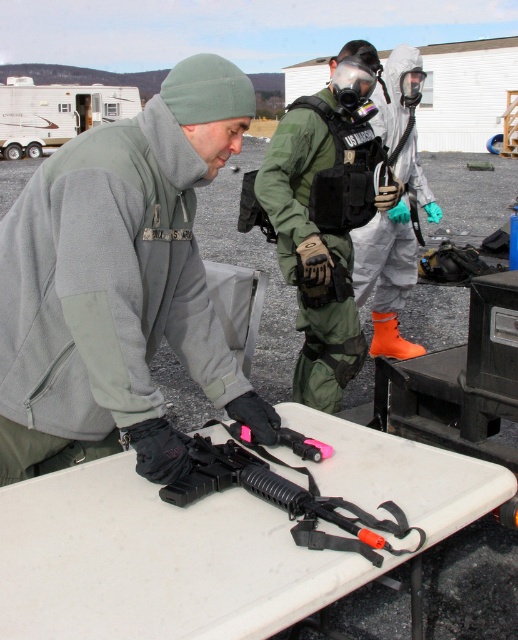
What are the coordinates of the gray fleece jacket at center?

The gray fleece jacket at center is located at point (119, 284).

You are a trainee who needs to determine if your green matte uniform at center can fit into a storage locker designed for items no larger than the black rubberized gun at center. Based on the scene, can your uniform fit?

The green matte uniform at center has a larger size compared to the black rubberized gun at center, so the uniform cannot fit into the storage locker designed for items no larger than the gun.